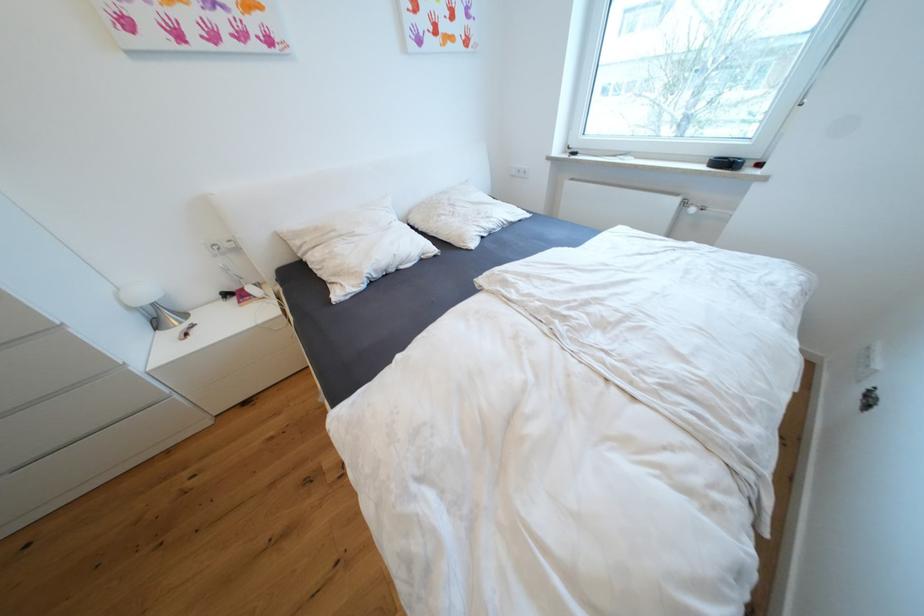
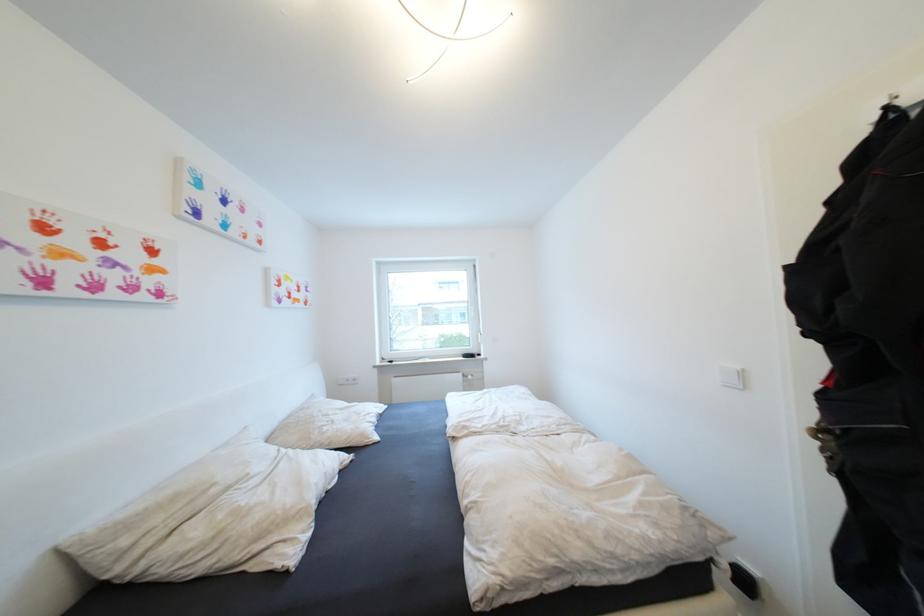
Locate, in the second image, the point that corresponds to [526,172] in the first image.

(355, 381)